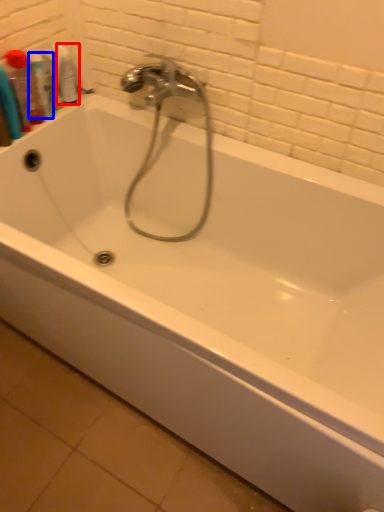
Question: Which object appears farthest to the camera in this image, mouthwash (highlighted by a red box) or mouthwash (highlighted by a blue box)?

Choices:
 (A) mouthwash
 (B) mouthwash

Answer: (A)